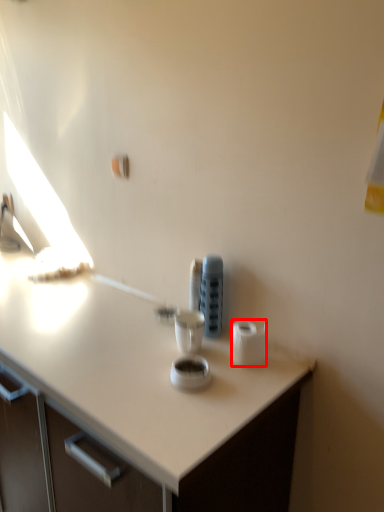
Question: From the image's perspective, what is the correct spatial relationship of toilet paper (annotated by the red box) in relation to appliance?

Choices:
 (A) below
 (B) above

Answer: (A)